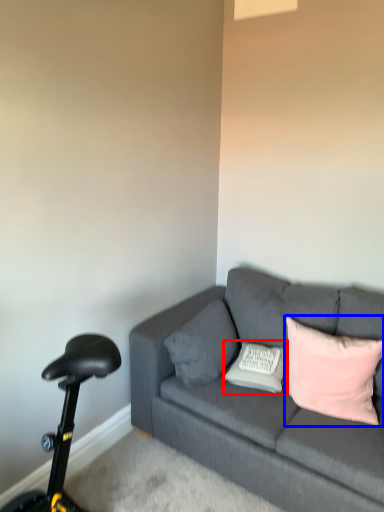
Question: Which point is closer to the camera, pillow (highlighted by a red box) or pillow (highlighted by a blue box)?

Choices:
 (A) pillow
 (B) pillow

Answer: (B)